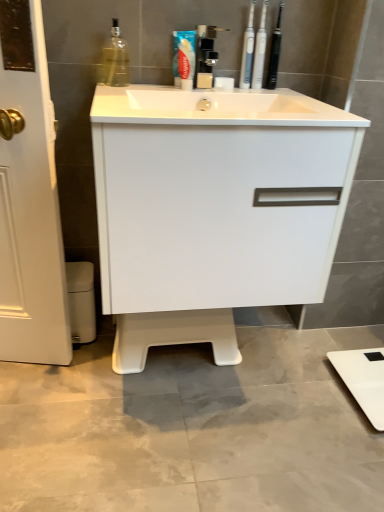
This screenshot has height=512, width=384. What are the coordinates of `vacant space to the right of blue glossy toothpaste at upper center` in the screenshot? It's located at (250, 92).